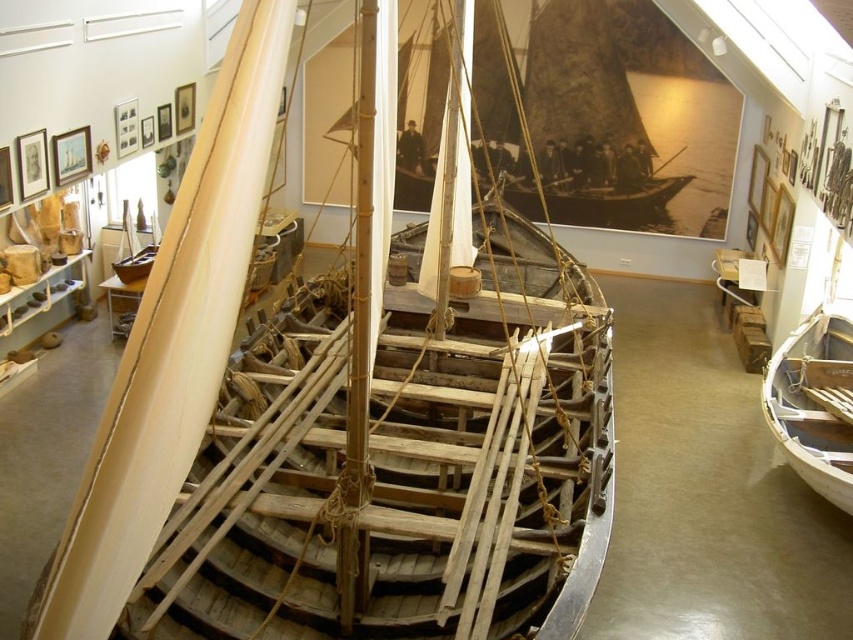
Question: Among these objects, which one is nearest to the camera?

Choices:
 (A) white wood boat at lower right
 (B) wooden sailboat at upper center

Answer: (A)

Question: Which point is closer to the camera taking this photo?

Choices:
 (A) (711, 128)
 (B) (784, 340)

Answer: (B)

Question: Is wooden sailboat at upper center bigger than white wood boat at lower right?

Choices:
 (A) no
 (B) yes

Answer: (A)

Question: Can you confirm if wooden boat at center is bigger than white wood boat at lower right?

Choices:
 (A) no
 (B) yes

Answer: (B)

Question: Among these points, which one is nearest to the camera?

Choices:
 (A) (724, 104)
 (B) (804, 376)

Answer: (B)

Question: Is wooden boat at center thinner than white wood boat at lower right?

Choices:
 (A) yes
 (B) no

Answer: (B)